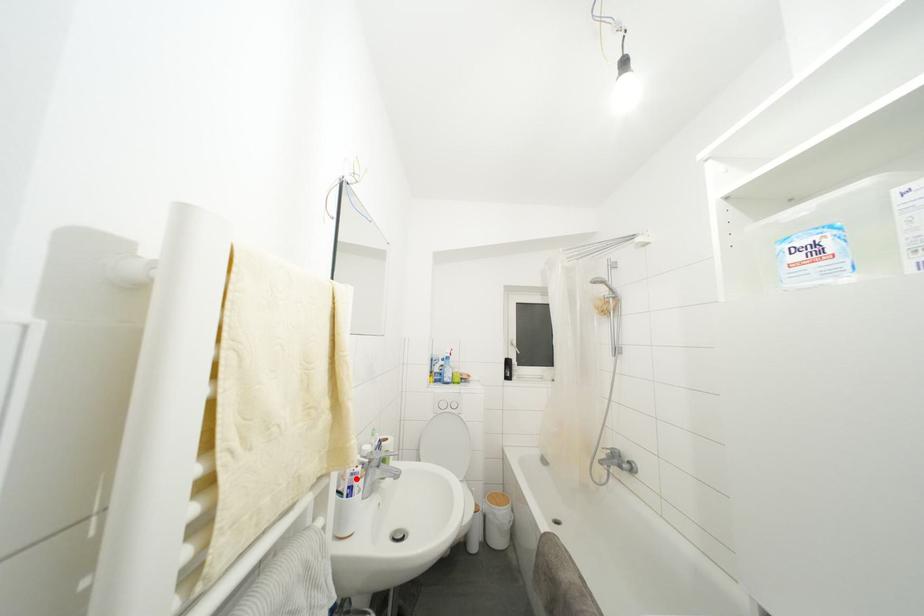
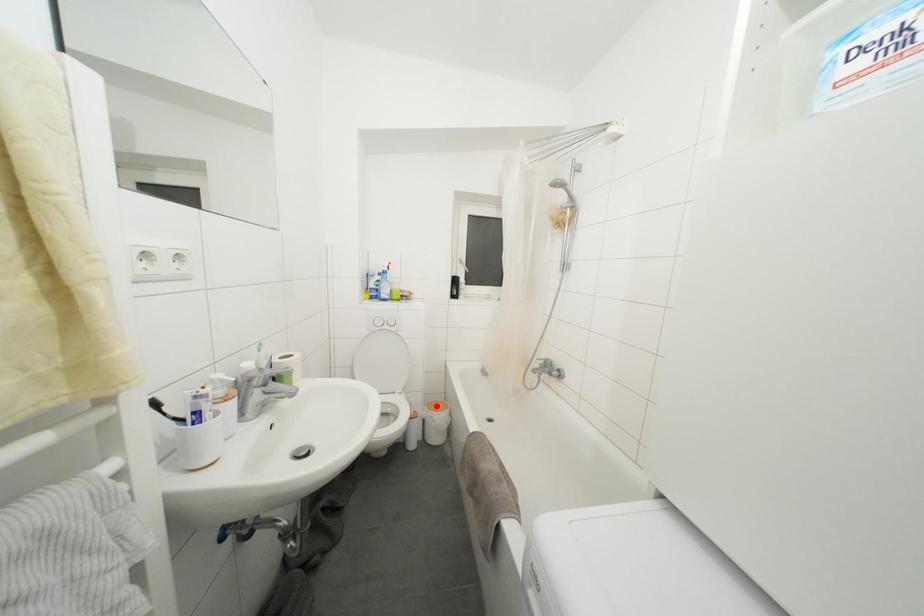
I am providing you with two images of the same scene from different viewpoints. A red point is marked on the first image and another point is marked on the second image. Is the marked point in image1 the same physical position as the marked point in image2?

No